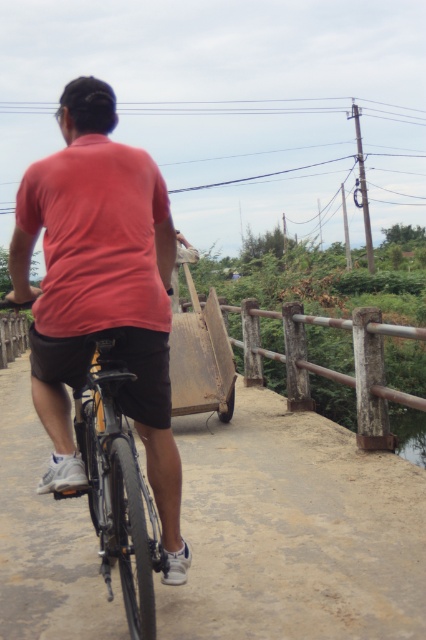
You are a cyclist planning to ride along the path shown in the image. The path has a wooden fence on one side and dense vegetation on the other. There is a point marked at coordinates (293, 531). What object is located at this point?

The point at coordinates (293, 531) indicates the matte black bicycle at center.

You are a delivery drone flying above the scene. You need to locate the matte black bicycle at center. What are the coordinates where you should direct your camera to focus?

The matte black bicycle at center is located at coordinates point (293,531).

You are a photographer trying to capture the matte black bicycle at center and the matte red shirt at center in a single frame. Based on their positions, can you tell which object is closer to the camera?

The matte black bicycle at center is positioned under the matte red shirt at center, which means the bicycle is closer to the camera than the shirt.